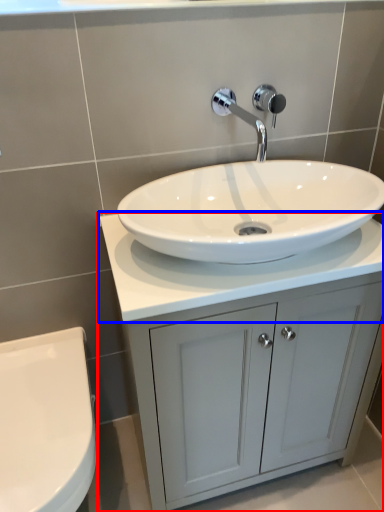
Question: Which object is closer to the camera taking this photo, bathroom cabinet (highlighted by a red box) or counter top (highlighted by a blue box)?

Choices:
 (A) bathroom cabinet
 (B) counter top

Answer: (B)